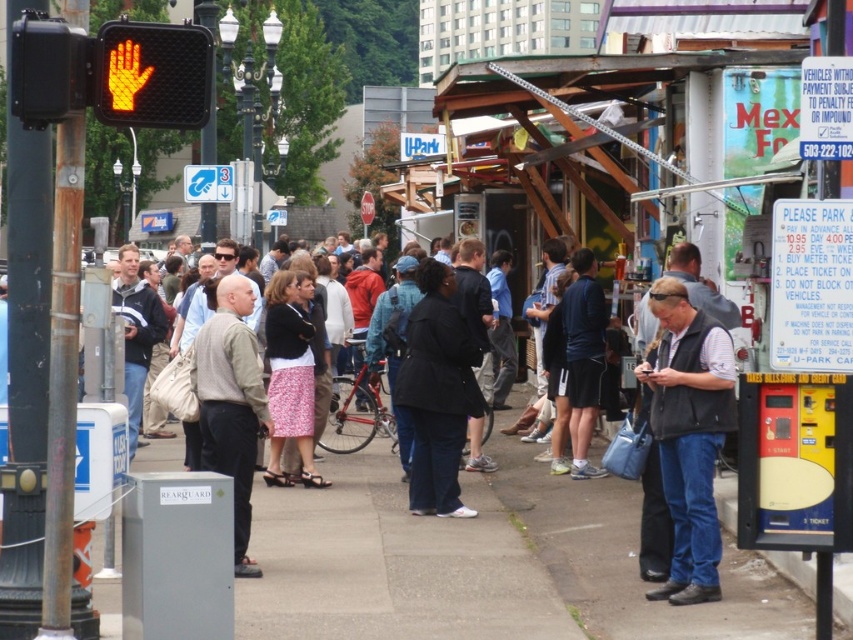
Which is behind, point (39, 16) or point (589, 420)?

Positioned behind is point (589, 420).

Does black plastic traffic light at upper left appear on the left side of dark blue jersey at center?

Correct, you'll find black plastic traffic light at upper left to the left of dark blue jersey at center.

What do you see at coordinates (48, 68) in the screenshot? Image resolution: width=853 pixels, height=640 pixels. I see `black plastic traffic light at upper left` at bounding box center [48, 68].

You are a GUI agent. You are given a task and a screenshot of the screen. Output one action in this format:
    pyautogui.click(x=<x>, y=<y>)
    Task: Click on the black plastic traffic light at upper left
    This screenshot has width=853, height=640.
    Given the screenshot: What is the action you would take?
    pyautogui.click(x=48, y=68)

Find the location of `black matte jacket at center`. black matte jacket at center is located at coordinates (437, 392).

Which is more to the right, black matte jacket at center or dark blue jersey at center?

dark blue jersey at center is more to the right.

Describe the element at coordinates (437, 392) in the screenshot. I see `black matte jacket at center` at that location.

Find the location of a particular element. The image size is (853, 640). black matte jacket at center is located at coordinates (437, 392).

Who is positioned more to the right, dark gray vest at center or black plastic traffic light at upper left?

dark gray vest at center is more to the right.

Can you confirm if dark gray vest at center is positioned below black plastic traffic light at upper left?

Indeed, dark gray vest at center is positioned under black plastic traffic light at upper left.

Image resolution: width=853 pixels, height=640 pixels. In order to click on dark gray vest at center in this screenshot , I will do `click(689, 435)`.

You are a GUI agent. You are given a task and a screenshot of the screen. Output one action in this format:
    pyautogui.click(x=<x>, y=<y>)
    Task: Click on the dark gray vest at center
    
    Given the screenshot: What is the action you would take?
    [x=689, y=435]